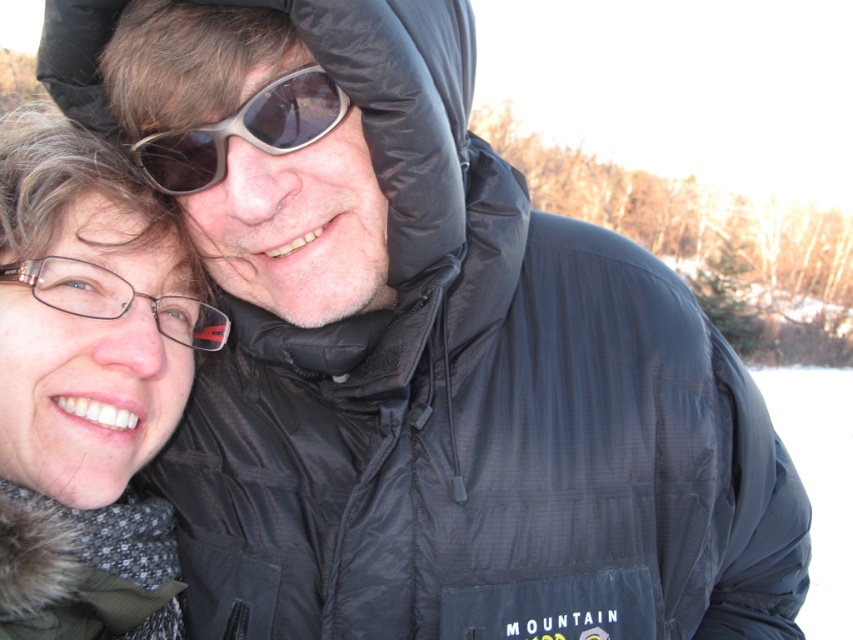
You are standing at point [222,125] and want to walk to point [207,326]. Which direction should you move relative to your current position?

You should move forward because point [207,326] is behind point [222,125], meaning it is in the direction you are facing.

You are standing in a snowy winter scene and see the matte black glasses at upper left. If your eyesight is normal, can you read the text on the logo of the person wearing the dark, puffy jacket with a hood on the right?

The matte black glasses at upper left and viewer are 35.40 inches apart, so the distance between you and the matte black glasses at upper left is 35.40 inches. Since the logo on the jacket is on the right individual who is further away than the glasses, the text on the logo may not be readable at that distance unless you have exceptional eyesight.

In the scene shown: You are an AI analyzing an image of two people in winter. The scene has a snowy background with two individuals. You need to determine the exact 2D coordinates of the matte black glasses at upper left. What are the coordinates?

The coordinates of the matte black glasses at upper left are at point [86,385].